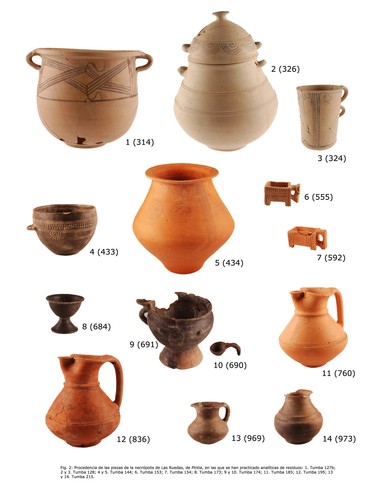
Find the location of a particular element. dark brown cup with damaged area is located at coordinates (181, 307), (166, 307).